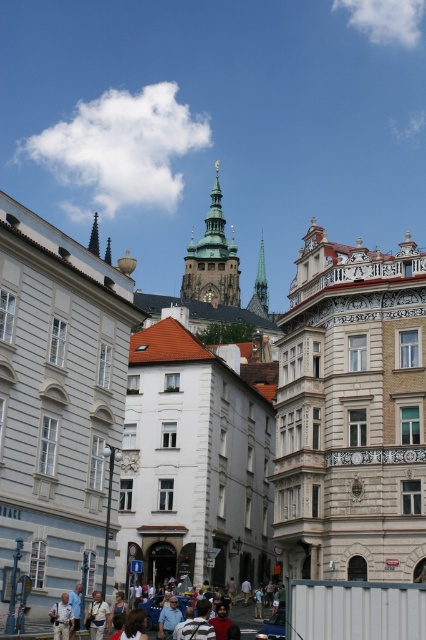
Which is above, white stone buildings at center or light brown leather jacket at lower center?

Positioned higher is white stone buildings at center.

Is point (275, 468) positioned before point (252, 596)?

That is False.

Which is in front, point (379, 541) or point (271, 621)?

Positioned in front is point (271, 621).

Identify the location of white stone buildings at center. The image size is (426, 640). (350, 413).

Is white stone buildings at center to the left of dark green stone spire at upper center from the viewer's perspective?

In fact, white stone buildings at center is to the right of dark green stone spire at upper center.

Image resolution: width=426 pixels, height=640 pixels. What do you see at coordinates (350, 413) in the screenshot?
I see `white stone buildings at center` at bounding box center [350, 413].

Locate an element on the screen. The image size is (426, 640). white stone buildings at center is located at coordinates (350, 413).

Does light brown leather jacket at lower center have a lesser width compared to dark green stone spire at upper center?

Yes.

Which is below, light brown leather jacket at lower center or dark green stone spire at upper center?

light brown leather jacket at lower center is below.

Is point (154, 614) closer to viewer compared to point (97, 243)?

Yes, it is in front of point (97, 243).

I want to click on light brown leather jacket at lower center, so click(x=256, y=618).